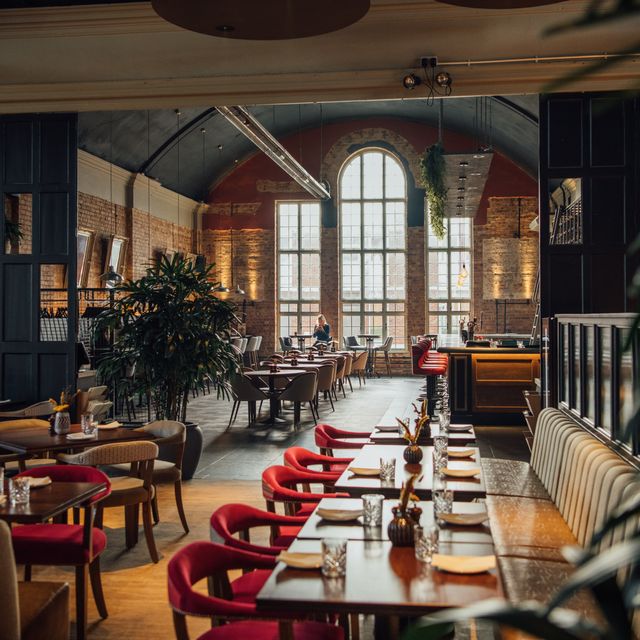
This screenshot has width=640, height=640. Find the location of `red chair`. red chair is located at coordinates (195, 566), (228, 521), (273, 473), (297, 454), (321, 429), (73, 475).